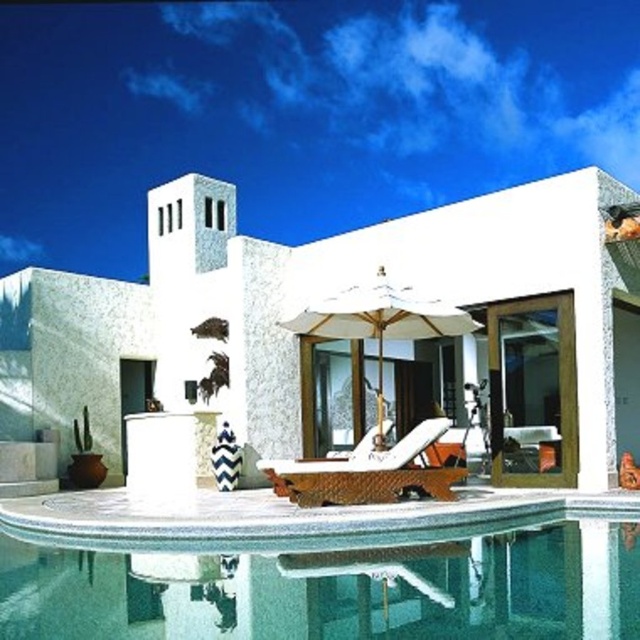
Question: Can you confirm if white textured villa at center is positioned above clear glass pool at lower center?

Choices:
 (A) yes
 (B) no

Answer: (A)

Question: Which object appears closest to the camera in this image?

Choices:
 (A) white fabric umbrella at center
 (B) white textured villa at center

Answer: (A)

Question: Does brown woven daybed at center have a lesser width compared to white fabric umbrella at center?

Choices:
 (A) yes
 (B) no

Answer: (A)

Question: Can you confirm if white textured villa at center is positioned to the right of white fabric umbrella at center?

Choices:
 (A) yes
 (B) no

Answer: (B)

Question: Which point appears farthest from the camera in this image?

Choices:
 (A) (150, 579)
 (B) (435, 490)

Answer: (B)

Question: Which object is closer to the camera taking this photo?

Choices:
 (A) clear glass pool at lower center
 (B) brown woven daybed at center
 (C) white fabric umbrella at center

Answer: (A)